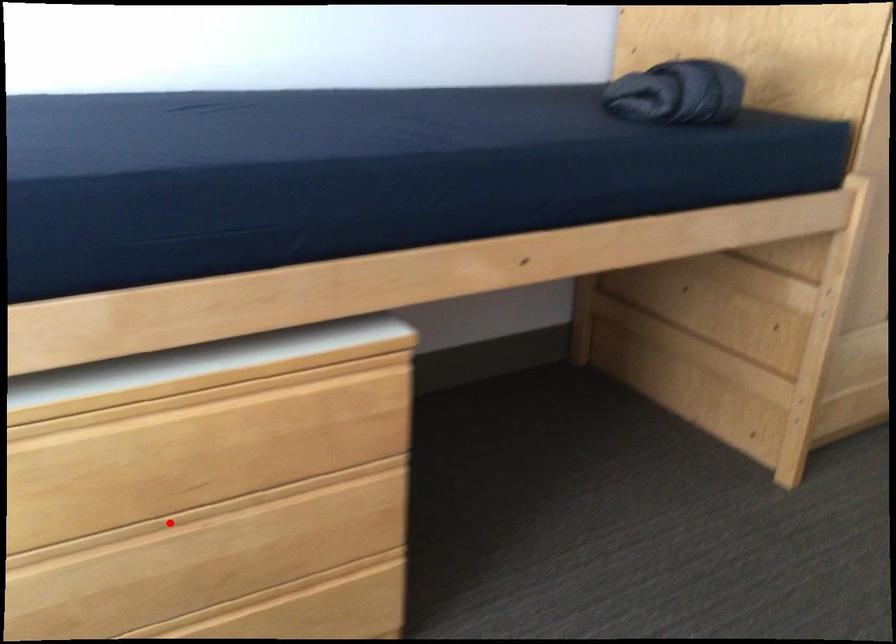
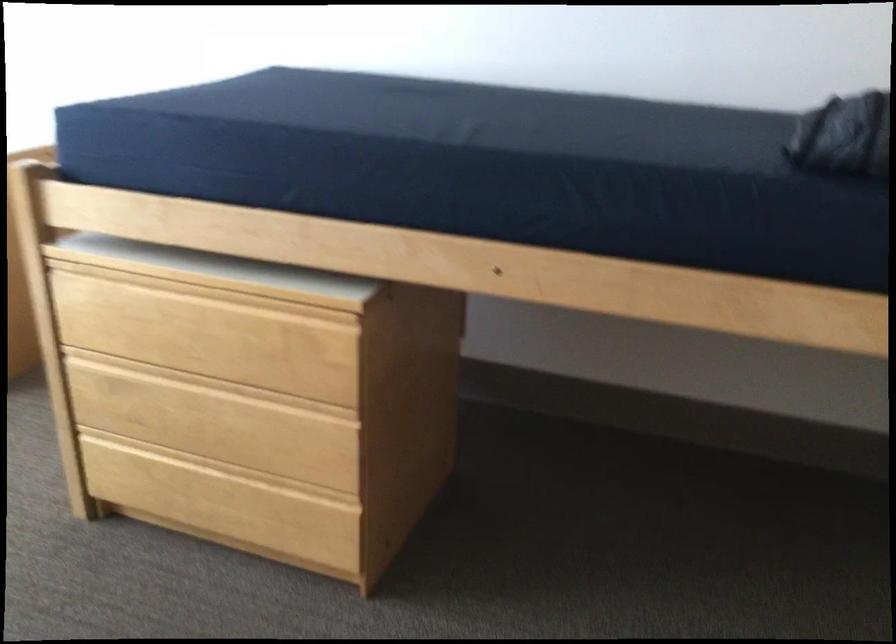
Question: I am providing you with two images of the same scene from different viewpoints. A red point is marked on the first image. Is the red point's position out of view in image 2?

Choices:
 (A) Yes
 (B) No

Answer: (B)